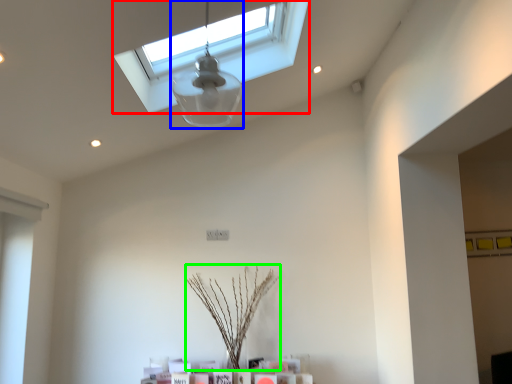
Question: Estimate the real-world distances between objects in this image. Which object is farther from window (highlighted by a red box), lamp (highlighted by a blue box) or plant (highlighted by a green box)?

Choices:
 (A) lamp
 (B) plant

Answer: (B)